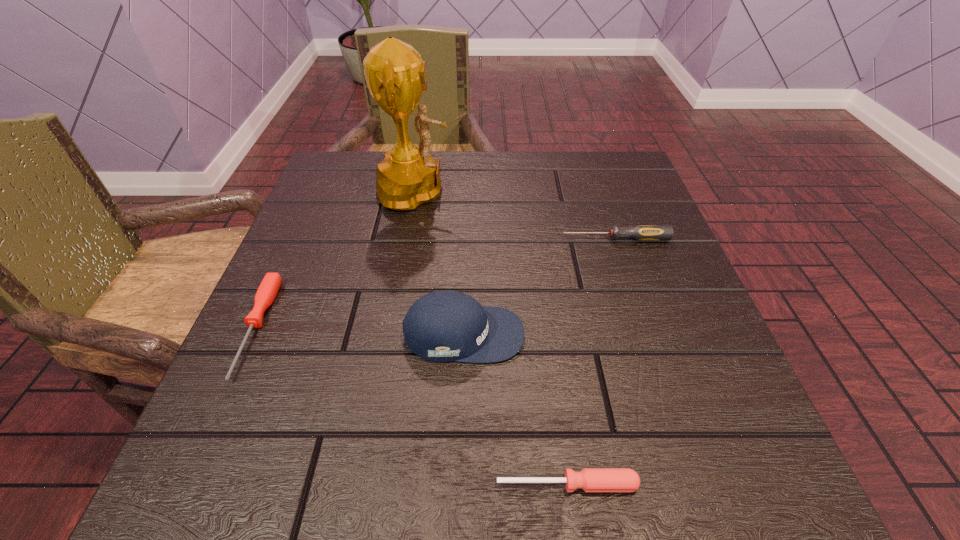
Find the location of a particular element. The height and width of the screenshot is (540, 960). object at the far left corner is located at coordinates (396, 75).

Find the location of a particular element. vacant space at the far edge of the desktop is located at coordinates (512, 152).

This screenshot has width=960, height=540. In order to click on free space at the near edge in this screenshot , I will do `click(425, 467)`.

The image size is (960, 540). I want to click on vacant space at the left edge of the desktop, so click(305, 232).

Image resolution: width=960 pixels, height=540 pixels. What are the coordinates of `free point at the right edge` in the screenshot? It's located at (677, 353).

Where is `vacant area at the far left corner`? The image size is (960, 540). vacant area at the far left corner is located at coordinates (374, 193).

Where is `free location at the far right corner`? free location at the far right corner is located at coordinates (633, 204).

Where is `vacant region at the near right corner`? vacant region at the near right corner is located at coordinates (741, 485).

The height and width of the screenshot is (540, 960). Identify the location of empty location between the nearest object and the third shortest object. (591, 361).

Locate an element on the screen. vacant area that lies between the tallest screwdriver and the farthest object is located at coordinates (519, 215).